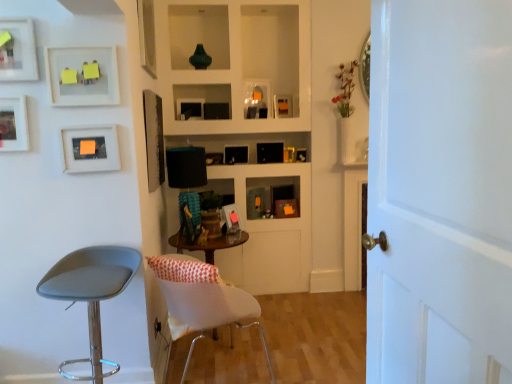
Measure the distance between gray leather stool at left, which is counted as the first chair, starting from the left, and camera.

gray leather stool at left, which is counted as the first chair, starting from the left, and camera are 1.90 meters apart.

Based on the photo, measure the distance between white fabric desk at center and camera.

9.93 feet.

The width and height of the screenshot is (512, 384). Find the location of `matte white picture frame at upper left, which is the 10th picture frame from back to front`. matte white picture frame at upper left, which is the 10th picture frame from back to front is located at coordinates (17, 50).

Measure the distance between point (x=5, y=137) and camera.

Point (x=5, y=137) and camera are 7.11 feet apart from each other.

The width and height of the screenshot is (512, 384). I want to click on white painted wood door at right, so click(440, 192).

This screenshot has height=384, width=512. Describe the element at coordinates (440, 192) in the screenshot. I see `white painted wood door at right` at that location.

Identify the location of matte black picture frame at center, placed as the fifth picture frame when sorted from back to front. Image resolution: width=512 pixels, height=384 pixels. (154, 139).

Measure the distance between matte black picture frame at center, arranged as the 7th picture frame when viewed from the front, and camera.

A distance of 10.64 feet exists between matte black picture frame at center, arranged as the 7th picture frame when viewed from the front, and camera.

You are a GUI agent. You are given a task and a screenshot of the screen. Output one action in this format:
    pyautogui.click(x=<x>, y=<y>)
    Task: Click on the gray leather stool at left, the 2th chair when ordered from right to left
    
    Given the screenshot: What is the action you would take?
    pyautogui.click(x=91, y=292)

From a real-world perspective, starting from the matte white picture frame at left, the 8th picture frame viewed from the back, which picture frame is the 1st one below it? Please provide its 2D coordinates.

[(154, 139)]

Is matte white picture frame at left, the 8th picture frame viewed from the back, behind matte black picture frame at center, arranged as the 6th picture frame when viewed from the front?

No, it is not.

Is matte white picture frame at left, the 8th picture frame viewed from the back, touching matte black picture frame at center, placed as the fifth picture frame when sorted from back to front?

No.

From a real-world perspective, is matte white picture frame at left, the 8th picture frame viewed from the back, physically below matte black picture frame at center, arranged as the 6th picture frame when viewed from the front?

No, from a real-world perspective, matte white picture frame at left, the 8th picture frame viewed from the back, is not below matte black picture frame at center, arranged as the 6th picture frame when viewed from the front.

Which is closer, (194, 58) or (11, 137)?

The point (11, 137) is in front.

How different are the orientations of green glossy vase at upper center and matte white picture frame at left, the 8th picture frame viewed from the back, in degrees?

There is a 3.58-degree angle between the facing directions of green glossy vase at upper center and matte white picture frame at left, the 8th picture frame viewed from the back.

Is green glossy vase at upper center in front of or behind matte white picture frame at left, the 8th picture frame viewed from the back, in the image?

green glossy vase at upper center is behind matte white picture frame at left, the 8th picture frame viewed from the back.

From a real-world perspective, which object rests below the other?

matte white picture frame at left, marked as the third picture frame in a front-to-back arrangement, is physically lower.

From a real-world perspective, between matte white picture frame at upper left, which appears as the 5th picture frame when viewed from the front, and matte black picture frame at center, arranged as the 7th picture frame when viewed from the front, who is vertically higher?

In real-world perspective, matte white picture frame at upper left, which appears as the 5th picture frame when viewed from the front, is above.

Considering the sizes of matte white picture frame at upper left, the 6th picture frame when ordered from back to front, and matte black picture frame at center, the fourth picture frame from the back, in the image, is matte white picture frame at upper left, the 6th picture frame when ordered from back to front, taller or shorter than matte black picture frame at center, the fourth picture frame from the back,?

matte white picture frame at upper left, the 6th picture frame when ordered from back to front, is taller than matte black picture frame at center, the fourth picture frame from the back.

Is matte white picture frame at upper left, the 6th picture frame when ordered from back to front, bigger than matte black picture frame at center, the fourth picture frame from the back?

Yes, matte white picture frame at upper left, the 6th picture frame when ordered from back to front, is bigger than matte black picture frame at center, the fourth picture frame from the back.

Between point (143, 23) and point (234, 213), which one is positioned behind?

Positioned behind is point (234, 213).

Is matte white picture frame at upper left, which appears as the 5th picture frame when viewed from the front, at the back of matte white picture frame at upper left, the 1th picture frame viewed from the front?

No.

From a real-world perspective, is matte white picture frame at upper left, which is the 10th picture frame from back to front, positioned over matte white picture frame at upper left, which appears as the 5th picture frame when viewed from the front, based on gravity?

No, from a real-world perspective, matte white picture frame at upper left, which is the 10th picture frame from back to front, is not on top of matte white picture frame at upper left, which appears as the 5th picture frame when viewed from the front.

Is matte white picture frame at upper left, which is the 10th picture frame from back to front, far from matte white picture frame at upper left, which appears as the 5th picture frame when viewed from the front?

Indeed, matte white picture frame at upper left, which is the 10th picture frame from back to front, is not near matte white picture frame at upper left, which appears as the 5th picture frame when viewed from the front.

Is matte black picture frame at upper center, marked as the 8th picture frame in a front-to-back arrangement, closer to camera compared to gray leather stool at left, the 2th chair when ordered from right to left?

That is False.

Consider the image. In terms of height, does matte black picture frame at upper center, acting as the 3th picture frame starting from the back, look taller or shorter compared to gray leather stool at left, which is counted as the first chair, starting from the left?

Clearly, matte black picture frame at upper center, acting as the 3th picture frame starting from the back, is shorter compared to gray leather stool at left, which is counted as the first chair, starting from the left.

Is matte black picture frame at upper center, marked as the 8th picture frame in a front-to-back arrangement, oriented towards gray leather stool at left, which is counted as the first chair, starting from the left?

No, matte black picture frame at upper center, marked as the 8th picture frame in a front-to-back arrangement, does not turn towards gray leather stool at left, which is counted as the first chair, starting from the left.

Looking at this image, based on their positions, is matte black picture frame at upper center, marked as the 8th picture frame in a front-to-back arrangement, located to the left or right of gray leather stool at left, which is counted as the first chair, starting from the left?

Based on their positions, matte black picture frame at upper center, marked as the 8th picture frame in a front-to-back arrangement, is located to the right of gray leather stool at left, which is counted as the first chair, starting from the left.

What's the angular difference between matte black picture frame at upper center, marked as the 8th picture frame in a front-to-back arrangement, and matte white picture frame at left, the 8th picture frame viewed from the back,'s facing directions?

There is a 9.94-degree angle between the facing directions of matte black picture frame at upper center, marked as the 8th picture frame in a front-to-back arrangement, and matte white picture frame at left, the 8th picture frame viewed from the back.

Where is `the 5th picture frame behind the matte white picture frame at left, marked as the third picture frame in a front-to-back arrangement, counting from the anchor's position`? The image size is (512, 384). the 5th picture frame behind the matte white picture frame at left, marked as the third picture frame in a front-to-back arrangement, counting from the anchor's position is located at coordinates (190, 108).

From a real-world perspective, which object stands above the other?

matte black picture frame at upper center, acting as the 3th picture frame starting from the back, is physically above.

Would you say matte white picture frame at left, marked as the third picture frame in a front-to-back arrangement, is outside matte white picture frame at upper left, acting as the 2th picture frame starting from the front?

That's correct, matte white picture frame at left, marked as the third picture frame in a front-to-back arrangement, is outside of matte white picture frame at upper left, acting as the 2th picture frame starting from the front.

Looking at this image, how far apart are matte white picture frame at left, marked as the third picture frame in a front-to-back arrangement, and matte white picture frame at upper left, which is the ninth picture frame in back-to-front order?

A distance of 12.22 inches exists between matte white picture frame at left, marked as the third picture frame in a front-to-back arrangement, and matte white picture frame at upper left, which is the ninth picture frame in back-to-front order.

From a real-world perspective, is matte white picture frame at left, marked as the third picture frame in a front-to-back arrangement, physically above matte white picture frame at upper left, which is the ninth picture frame in back-to-front order?

Incorrect, from a real-world perspective, matte white picture frame at left, marked as the third picture frame in a front-to-back arrangement, is lower than matte white picture frame at upper left, which is the ninth picture frame in back-to-front order.

Based on the photo, does matte white picture frame at left, the 8th picture frame viewed from the back, have a larger size compared to matte white picture frame at upper left, which is the ninth picture frame in back-to-front order?

Actually, matte white picture frame at left, the 8th picture frame viewed from the back, might be smaller than matte white picture frame at upper left, which is the ninth picture frame in back-to-front order.

Locate an element on the screen. the 1st picture frame directly above the matte black picture frame at center, arranged as the 6th picture frame when viewed from the front (from a real-world perspective) is located at coordinates (13, 124).

Image resolution: width=512 pixels, height=384 pixels. What are the coordinates of `the 5th picture frame in front of the green glossy vase at upper center, counting from the anchor's position` in the screenshot? It's located at (13, 124).

Which object lies further to the anchor point white fabric chair at center, which is the 2th chair from left to right, matte white picture frame at left, the 8th picture frame viewed from the back, or white fabric desk at center?

matte white picture frame at left, the 8th picture frame viewed from the back.

Considering their positions, is matte black picture frame at upper center, marked as the 8th picture frame in a front-to-back arrangement, positioned further to white painted wood door at right than matte black picture frame at upper center, which appears as the tenth picture frame when viewed from the front?

Based on the image, matte black picture frame at upper center, which appears as the tenth picture frame when viewed from the front, appears to be further to white painted wood door at right.

Estimate the real-world distances between objects in this image. Which object is further from matte black picture frame at upper center, marked as the 9th picture frame in a front-to-back arrangement, matte white picture frame at upper left, which is the ninth picture frame in back-to-front order, or gray leather stool at left, the 2th chair when ordered from right to left?

gray leather stool at left, the 2th chair when ordered from right to left, is positioned further to the anchor matte black picture frame at upper center, marked as the 9th picture frame in a front-to-back arrangement.

When comparing their distances from white painted wood door at right, does green glossy vase at upper center or matte white picture frame at upper left, acting as the 2th picture frame starting from the front, seem further?

green glossy vase at upper center.

From the image, which object appears to be nearer to gray leather stool at left, which is counted as the first chair, starting from the left, matte orange paper at upper left, arranged as the 4th picture frame when viewed from the front, or matte black picture frame at upper center, acting as the 3th picture frame starting from the back?

matte orange paper at upper left, arranged as the 4th picture frame when viewed from the front, is closer to gray leather stool at left, which is counted as the first chair, starting from the left.

From the image, which object appears to be farther from matte black picture frame at upper center, acting as the 3th picture frame starting from the back, matte white picture frame at left, marked as the third picture frame in a front-to-back arrangement, or matte black picture frame at center, placed as the fifth picture frame when sorted from back to front?

Based on the image, matte white picture frame at left, marked as the third picture frame in a front-to-back arrangement, appears to be further to matte black picture frame at upper center, acting as the 3th picture frame starting from the back.

Estimate the real-world distances between objects in this image. Which object is further from matte black picture frame at center, arranged as the 7th picture frame when viewed from the front, matte black picture frame at upper center, marked as the 8th picture frame in a front-to-back arrangement, or matte white picture frame at left, marked as the third picture frame in a front-to-back arrangement?

Based on the image, matte white picture frame at left, marked as the third picture frame in a front-to-back arrangement, appears to be further to matte black picture frame at center, arranged as the 7th picture frame when viewed from the front.

Which object lies further to the anchor point white fabric desk at center, green glossy vase at upper center or matte orange paper at upper left, arranged as the 4th picture frame when viewed from the front?

The object further to white fabric desk at center is green glossy vase at upper center.

You are a GUI agent. You are given a task and a screenshot of the screen. Output one action in this format:
    pyautogui.click(x=<x>, y=<y>)
    Task: Click on the vase between matte white picture frame at left, marked as the third picture frame in a front-to-back arrangement, and matte black picture frame at upper center, marked as the 9th picture frame in a front-to-back arrangement, along the z-axis
    Image resolution: width=512 pixels, height=384 pixels.
    Given the screenshot: What is the action you would take?
    pyautogui.click(x=200, y=58)

The height and width of the screenshot is (384, 512). Identify the location of desk between white painted wood door at right and matte black picture frame at center, the fourth picture frame from the back, from front to back. (208, 244).

The width and height of the screenshot is (512, 384). I want to click on desk between matte orange paper at upper left, the 7th picture frame from the back, and gray leather stool at left, which is counted as the first chair, starting from the left, vertically, so click(x=208, y=244).

Where is `desk positioned between matte white picture frame at upper left, which is the 10th picture frame from back to front, and matte black picture frame at upper center, which appears as the tenth picture frame when viewed from the front, from near to far`? This screenshot has width=512, height=384. desk positioned between matte white picture frame at upper left, which is the 10th picture frame from back to front, and matte black picture frame at upper center, which appears as the tenth picture frame when viewed from the front, from near to far is located at coordinates (208, 244).